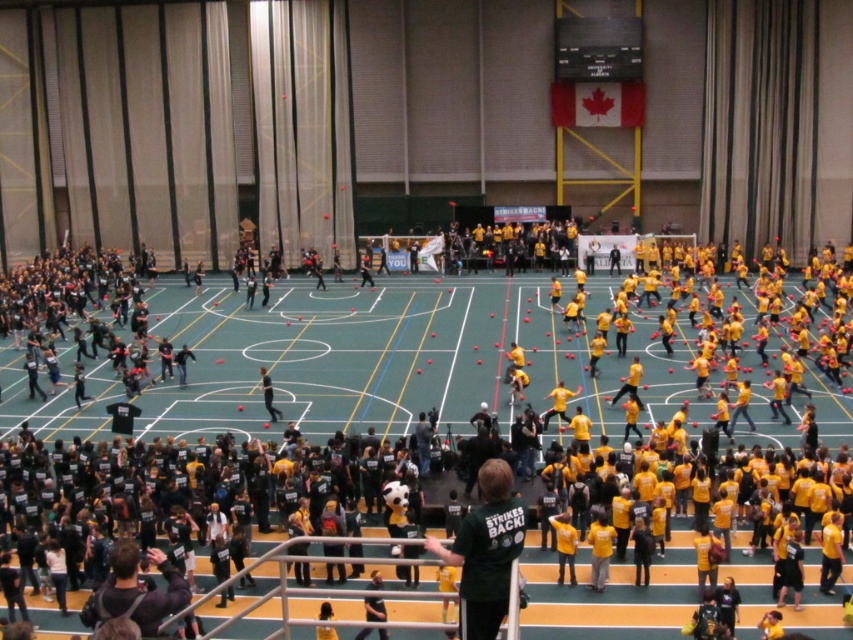
You are organizing a photo shoot in the sports hall and need to position two models wearing the green jersey at center and the yellow jersey at center. To ensure both are visible in the frame, which jersey should be placed closer to the camera to avoid being obscured by the other?

The yellow jersey at center should be placed closer to the camera because its width is smaller than the green jersey at center, allowing it to be positioned without blocking the larger green jersey at center.

You are organizing a group photo and need to arrange participants so that the green jersey at center and the yellow matte shirt at center can be seen clearly. Based on their positions, which participant should be moved slightly to the side to avoid blocking the view?

The green jersey at center might be wider than yellow matte shirt at center, so moving the green jersey at center slightly to the side would help avoid blocking the view.

You are a photographer standing at the back of the sports hall. You need to capture a photo of both the green jersey at center and the yellow jersey at center. Can you see both of them clearly in your current position?

The green jersey at center is located below the yellow jersey at center, so if you are standing at the back, you should be able to see both clearly as they are positioned at the center and one is below the other, not blocking the view.